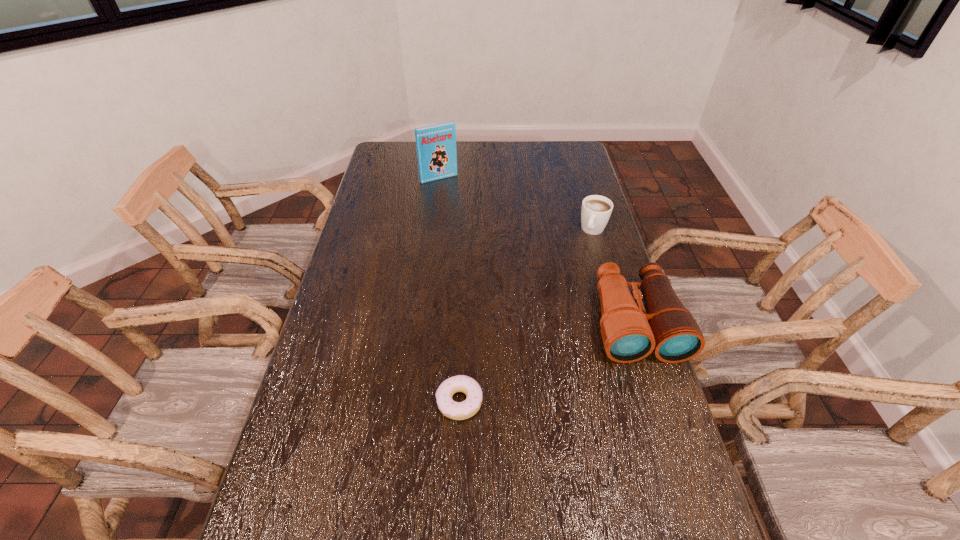
Locate an element on the screen. The height and width of the screenshot is (540, 960). free space located 0.340m on the front cover of the tallest object is located at coordinates (479, 230).

The image size is (960, 540). I want to click on vacant space located on the front cover of the tallest object, so click(459, 202).

This screenshot has height=540, width=960. Find the location of `free location located 0.160m on the front cover of the tallest object`. free location located 0.160m on the front cover of the tallest object is located at coordinates (460, 204).

Find the location of a particular element. vacant point located 0.090m with the handle on the side of the cappuccino is located at coordinates (583, 256).

At what (x,y) coordinates should I click in order to perform the action: click on free space located with the handle on the side of the cappuccino. Please return your answer as a coordinate pair (x, y). The image size is (960, 540). Looking at the image, I should click on (581, 260).

Find the location of a particular element. free space located 0.370m with the handle on the side of the cappuccino is located at coordinates (558, 312).

Find the location of a particular element. Image resolution: width=960 pixels, height=540 pixels. binoculars located at the right edge is located at coordinates (629, 334).

Find the location of a particular element. cappuccino present at the right edge is located at coordinates (596, 210).

Find the location of a particular element. The height and width of the screenshot is (540, 960). free spot at the far edge of the desktop is located at coordinates (505, 152).

Locate an element on the screen. blank space at the left edge of the desktop is located at coordinates (378, 234).